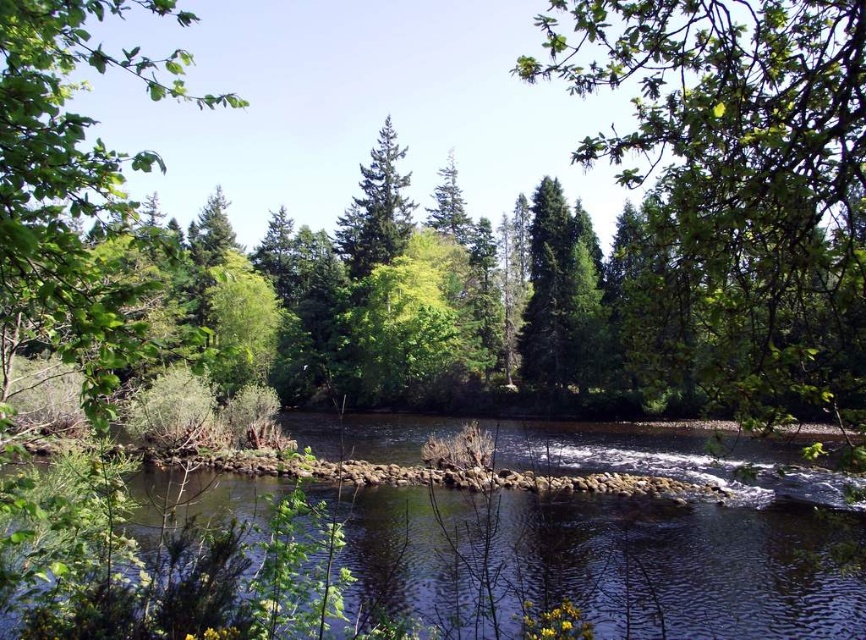
Which is behind, point (630, 132) or point (548, 538)?

Point (630, 132)

Does green leafy tree at upper right appear under smooth stone river at center?

Incorrect, green leafy tree at upper right is not positioned below smooth stone river at center.

Measure the distance between green leafy tree at upper right and camera.

A distance of 10.22 feet exists between green leafy tree at upper right and camera.

This screenshot has width=866, height=640. In order to click on green leafy tree at upper right in this screenshot , I will do `click(735, 195)`.

Can you confirm if green leafy tree at upper right is bigger than green leafy tree at left?

Incorrect, green leafy tree at upper right is not larger than green leafy tree at left.

Who is taller, green leafy tree at upper right or green leafy tree at left?

Standing taller between the two is green leafy tree at upper right.

Who is more distant from viewer, (635, 289) or (20, 228)?

The point (635, 289) is behind.

Identify the location of green leafy tree at upper right. The width and height of the screenshot is (866, 640). (735, 195).

Does point (424, 432) come closer to viewer compared to point (91, 177)?

That is False.

Is point (364, 522) closer to camera compared to point (66, 100)?

Yes, it is in front of point (66, 100).

The image size is (866, 640). Identify the location of smooth stone river at center. (612, 561).